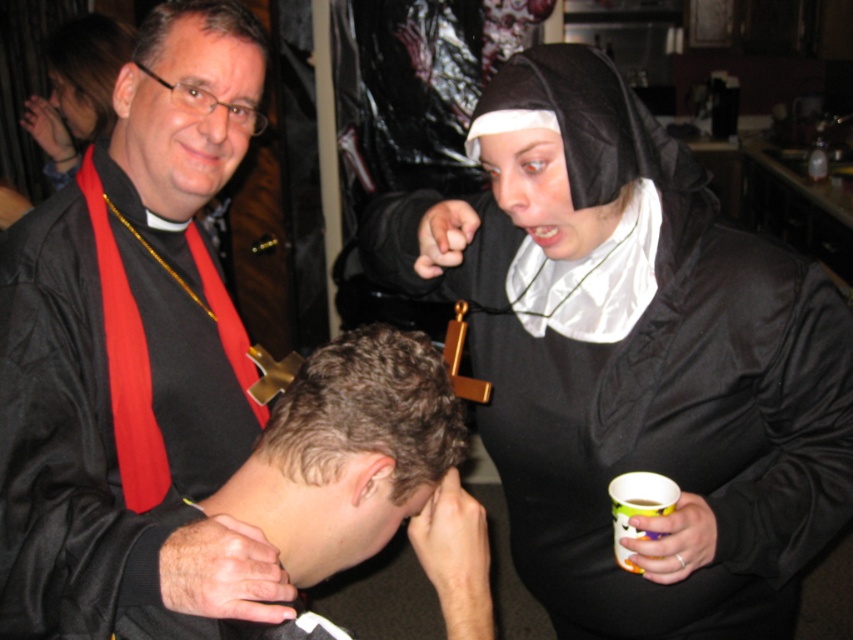
Question: Among these points, which one is farthest from the camera?

Choices:
 (A) (595, 202)
 (B) (215, 500)

Answer: (A)

Question: Among these objects, which one is nearest to the camera?

Choices:
 (A) curly brown hair at center
 (B) black satin nun at upper right
 (C) matte black nun's habit at upper right
 (D) black satin robe at center

Answer: (D)

Question: Is matte black nun's habit at upper right behind white paper cup at lower right?

Choices:
 (A) no
 (B) yes

Answer: (B)

Question: Which point is closer to the camera?

Choices:
 (A) matte black nun's habit at upper right
 (B) dark brown hair at upper left
 (C) matte black head at upper left

Answer: (C)

Question: Can you confirm if curly brown hair at center is smaller than matte black nun's habit at upper right?

Choices:
 (A) no
 (B) yes

Answer: (B)

Question: Does black satin robe at center lie behind dark brown hair at upper left?

Choices:
 (A) no
 (B) yes

Answer: (A)